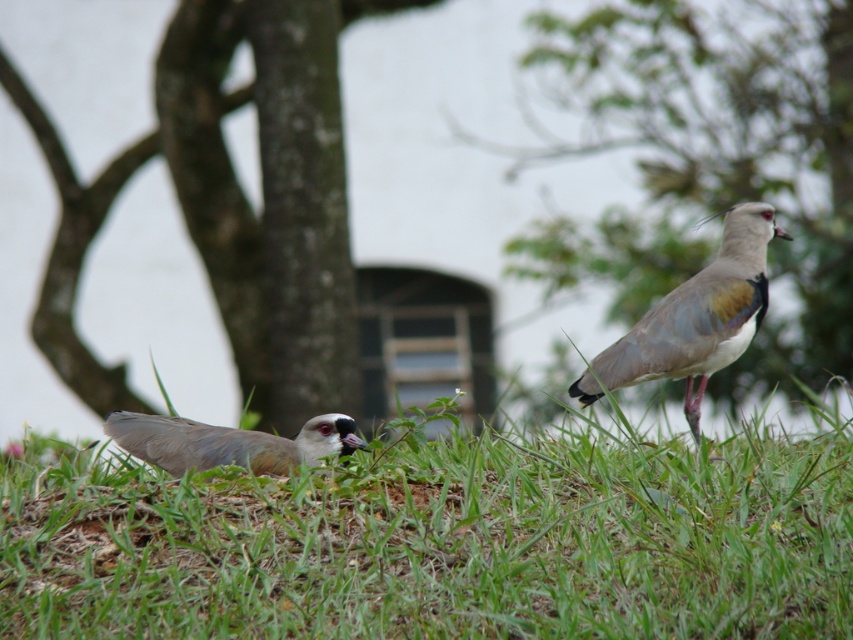
Is green grass at lower left further to camera compared to green leafy tree at center?

That is False.

Does green grass at lower left appear over green leafy tree at center?

No.

Is point (241, 609) positioned before point (787, 317)?

Yes, point (241, 609) is in front of point (787, 317).

Find the location of a particular element. green grass at lower left is located at coordinates pyautogui.click(x=438, y=540).

Who is more forward, [131,477] or [701,296]?

Point [131,477]

Between green grass at lower left and brown feathered bird at right, which one has less height?

green grass at lower left is shorter.

I want to click on green grass at lower left, so click(x=438, y=540).

Can you confirm if green leafy tree at center is bigger than brown feathered bird at right?

Yes, green leafy tree at center is bigger than brown feathered bird at right.

What are the coordinates of `green leafy tree at center` in the screenshot? It's located at (709, 161).